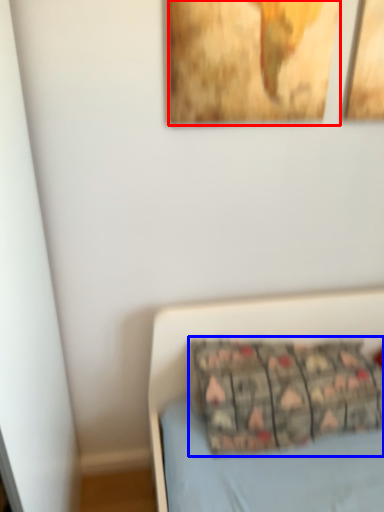
Question: Which object is further to the camera taking this photo, picture frame (highlighted by a red box) or pillow (highlighted by a blue box)?

Choices:
 (A) picture frame
 (B) pillow

Answer: (B)